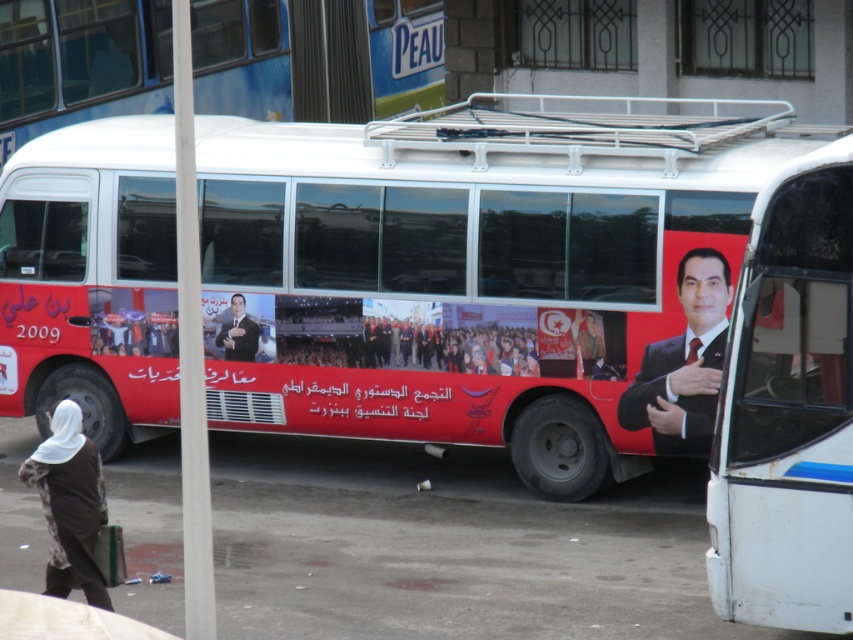
Is brown fabric hijab at lower left further to camera compared to smooth black suit at center?

No, it is in front of smooth black suit at center.

Who is more distant from viewer, (84, 541) or (248, 333)?

Positioned behind is point (248, 333).

Between point (48, 506) and point (241, 355), which one is positioned behind?

The point (241, 355) is behind.

Where is `brown fabric hijab at lower left`? brown fabric hijab at lower left is located at coordinates (68, 504).

Does point (787, 346) come behind point (712, 424)?

That is False.

Identify the location of white matte bus at right. (788, 408).

Does smooth suit at right have a lesser height compared to brown fabric hijab at lower left?

In fact, smooth suit at right may be taller than brown fabric hijab at lower left.

Is point (695, 356) less distant than point (51, 564)?

No, (695, 356) is further to viewer.

Find the location of a particular element. The image size is (853, 640). smooth suit at right is located at coordinates (683, 364).